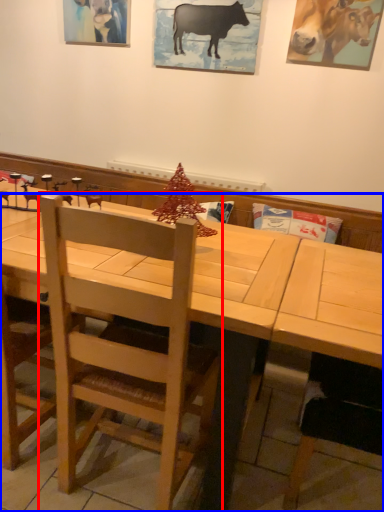
Question: Among these objects, which one is farthest to the camera, chair (highlighted by a red box) or table (highlighted by a blue box)?

Choices:
 (A) chair
 (B) table

Answer: (A)